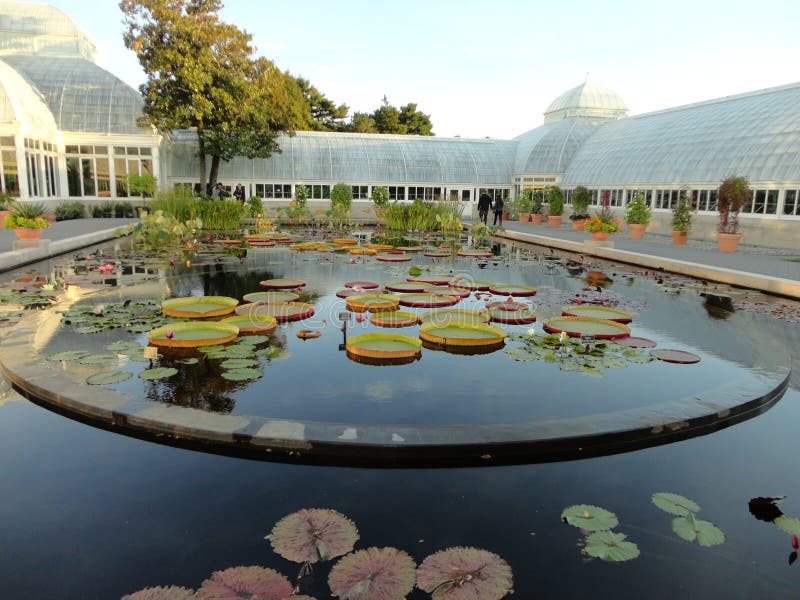
You are a GUI agent. You are given a task and a screenshot of the screen. Output one action in this format:
    pyautogui.click(x=<x>, y=<y>)
    Task: Click on the windows
    Image resolution: width=800 pixels, height=600 pixels.
    Given the screenshot: What is the action you would take?
    (x=704, y=199), (x=766, y=201)